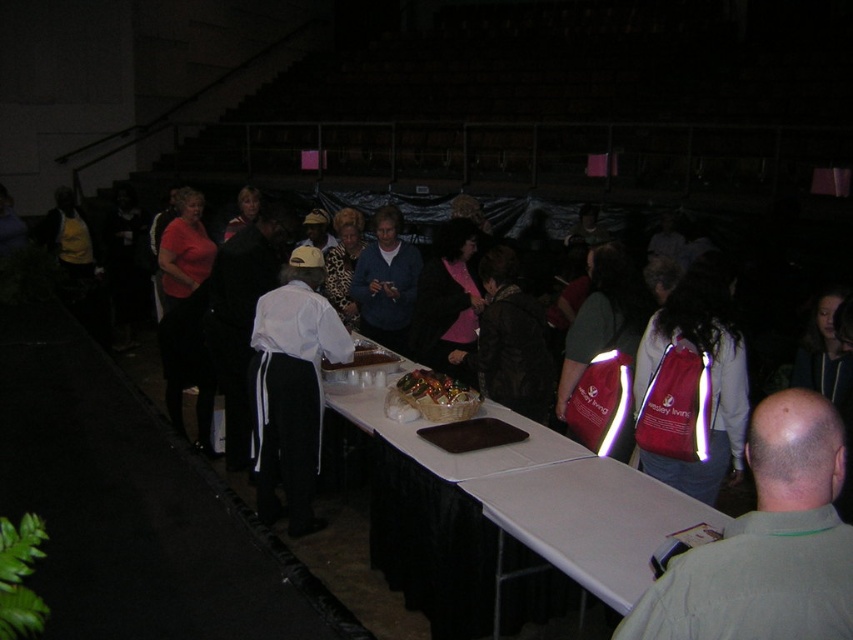
You are at an event and need to place a large centerpiece on the table. Considering the white matte table at lower right and the blue sweater at center, which object has more space available for placing the centerpiece?

The blue sweater at center has more space available because the white matte table at lower right occupies less space than it.